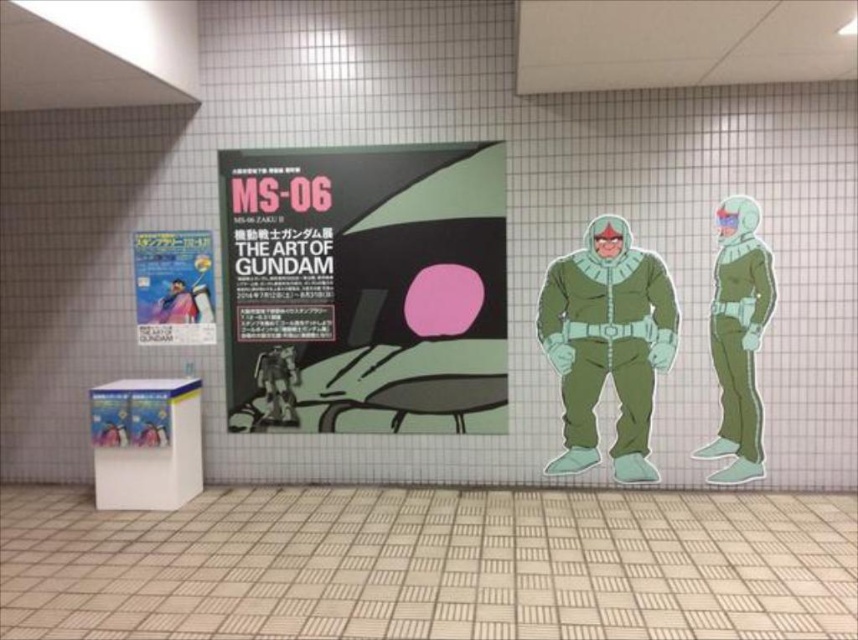
From the picture: You are standing in the hallway and need to place a new poster exactly at the center of the wall. The current poster is titled MS06 THE ART OF GUNDAM. Where should you position the new poster relative to the green matte astronaut suit at right?

The green matte astronaut suit at right is located at point (738, 339). To place the new poster at the center of the wall, position it at the center coordinates, which would be different from the astronaut suit location.

You are a maintenance worker needing to clean the area between the matte black poster at center and the matte paper poster at left. The cleaning tool you have is 28 inches long. Can you reach the entire space between them without moving the tool?

The distance between the matte black poster at center and the matte paper poster at left is 27.67 inches. Since your tool is 28 inches long, which is slightly longer than the gap, you can indeed reach the entire space between them without needing to move the tool.

You are a museum guide leading a group through the hallway. You need to point out both the matte paper poster at left and the metallic silver robot at center to your visitors. Which object should you mention first to follow the natural left to right viewing order?

You should mention the matte paper poster at left first because it is positioned to the left of the metallic silver robot at center, following the natural left to right viewing order.